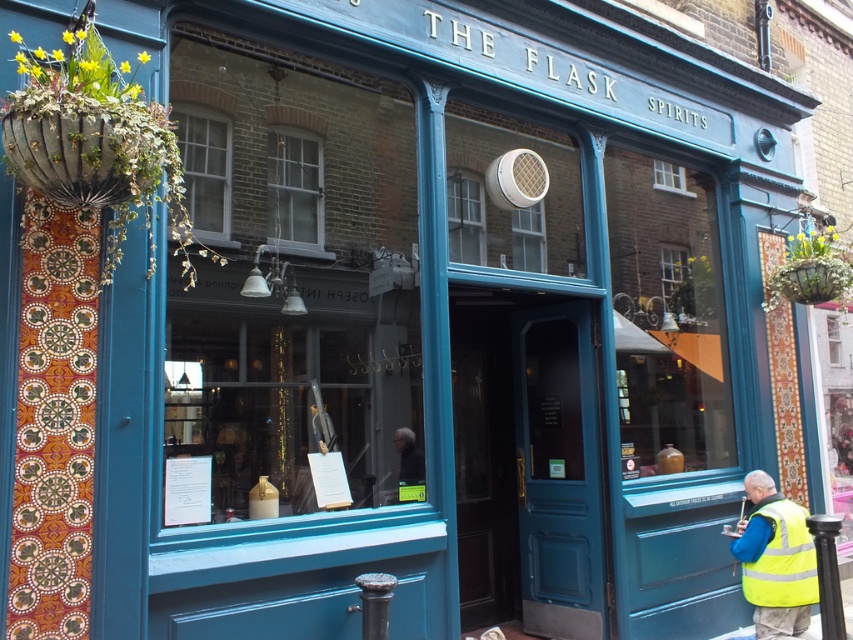
You are a delivery person arriving at The Flask Spirits store. You need to place a yellow reflective safety vest at lower right in a visible location near the entrance. Based on the scene, where would be the best place to put it?

The best place to put the yellow reflective safety vest at lower right would be near the entrance, possibly on a hook or shelf close to the front door where it is easily accessible and visible to staff and customers.

You are a customer entering The Flask Spirits and notice the yellow reflective safety vest at lower right and the dark blue jacket at center. Which item is positioned lower in the store?

The yellow reflective safety vest at lower right is located below the dark blue jacket at center, so it is positioned lower in the store.